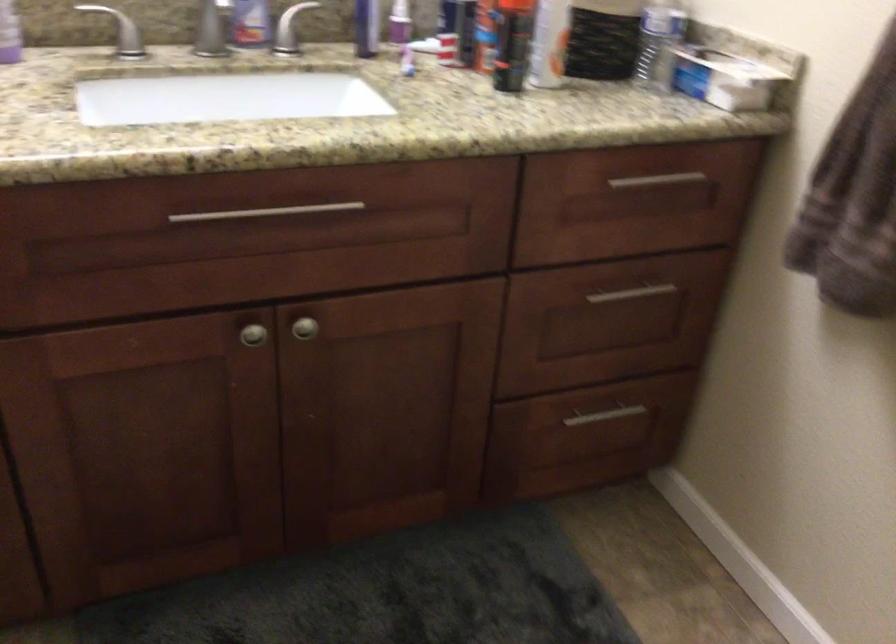
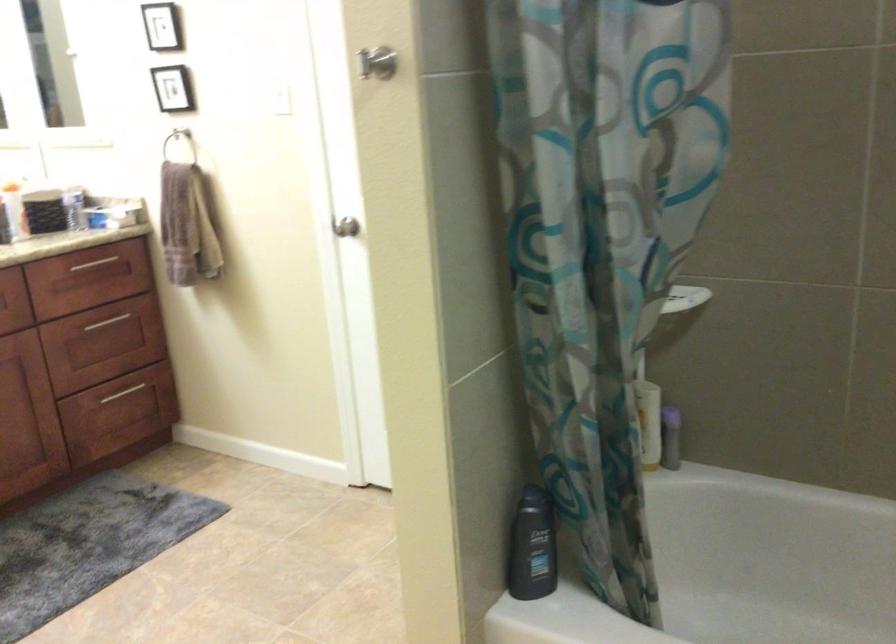
In the second image, find the point that corresponds to the point at 633,187 in the first image.

(92, 263)